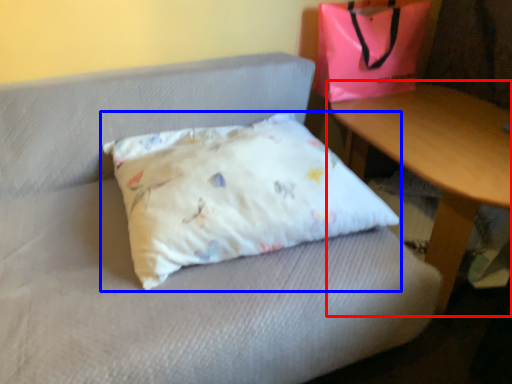
Question: Which point is closer to the camera, table (highlighted by a red box) or pillow (highlighted by a blue box)?

Choices:
 (A) table
 (B) pillow

Answer: (B)